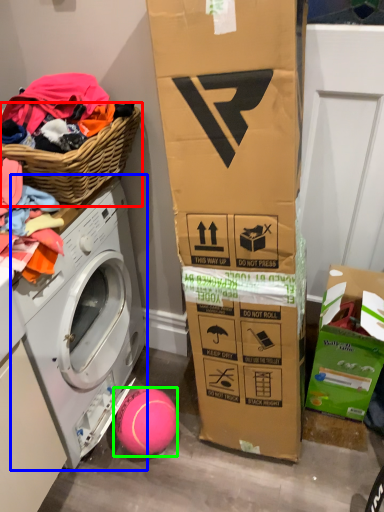
Question: Which object is the farthest from basket (highlighted by a red box)? Choose among these: washing machine (highlighted by a blue box) or ball (highlighted by a green box).

Choices:
 (A) washing machine
 (B) ball

Answer: (B)